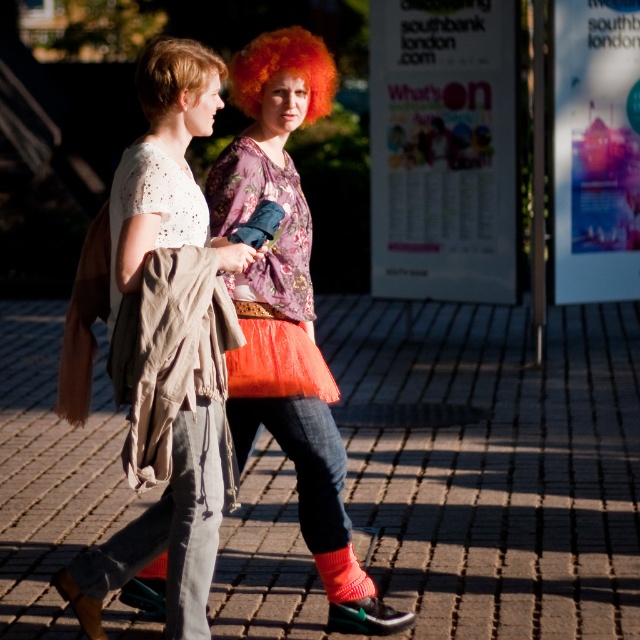
Looking at this image, you are standing at the point marked by the coordinates point (x=492, y=461) which is brick pavement at center. You want to walk towards the person on the left. Which direction should you move relative to your current position?

Since the point (x=492, y=461) is brick pavement at center, you should move to the left to reach the person on the left.

You are a photographer trying to capture the two people walking on the brick pavement at center and the orange tulle skirt at center. Since you want to include both subjects in the frame, which direction should you position yourself relative to the subjects to ensure both are visible?

Since the brick pavement at center is to the left of orange tulle skirt at center, you should position yourself to the right of the subjects to include both in the frame.

You are a fashion designer observing two orange items in the image. The orange tulle skirt at center and the knitted orange sock at lower center. Which of these two items is taller?

The orange tulle skirt at center is taller than the knitted orange sock at lower center.